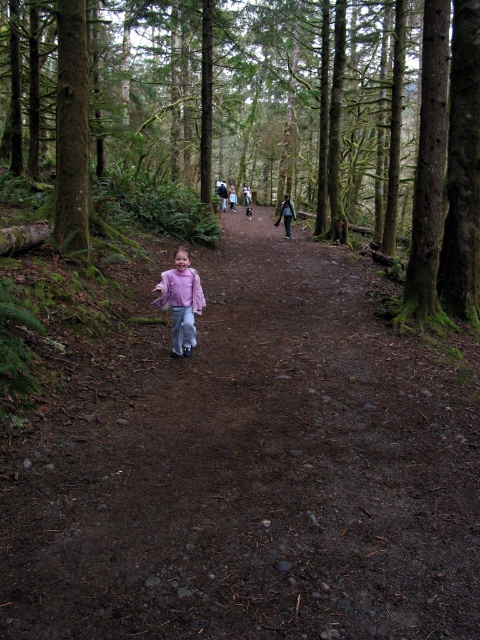
Is green mossy tree at center smaller than matte pink shirt at center?

Actually, green mossy tree at center might be larger than matte pink shirt at center.

Between green mossy tree at center and matte pink shirt at center, which one appears on the right side from the viewer's perspective?

matte pink shirt at center

Does point (23, 125) come farther from viewer compared to point (177, 282)?

That is True.

At what (x,y) coordinates should I click in order to perform the action: click on green mossy tree at center. Please return your answer as a coordinate pair (x, y). This screenshot has width=480, height=640. Looking at the image, I should click on (308, 115).

Who is positioned more to the right, brown dirt path at center or matte pink jacket at center?

From the viewer's perspective, brown dirt path at center appears more on the right side.

Which is behind, point (310, 291) or point (195, 307)?

The point (310, 291) is behind.

The height and width of the screenshot is (640, 480). In order to click on brown dirt path at center in this screenshot , I will do `click(252, 468)`.

Which is behind, point (197, 500) or point (433, 160)?

Point (433, 160)

Which is more to the left, brown dirt path at center or green mossy tree at center?

green mossy tree at center is more to the left.

Between point (337, 468) and point (462, 216), which one is positioned in front?

Positioned in front is point (337, 468).

You are a GUI agent. You are given a task and a screenshot of the screen. Output one action in this format:
    pyautogui.click(x=<x>, y=<y>)
    Task: Click on the brown dirt path at center
    The height and width of the screenshot is (640, 480).
    Given the screenshot: What is the action you would take?
    pyautogui.click(x=252, y=468)